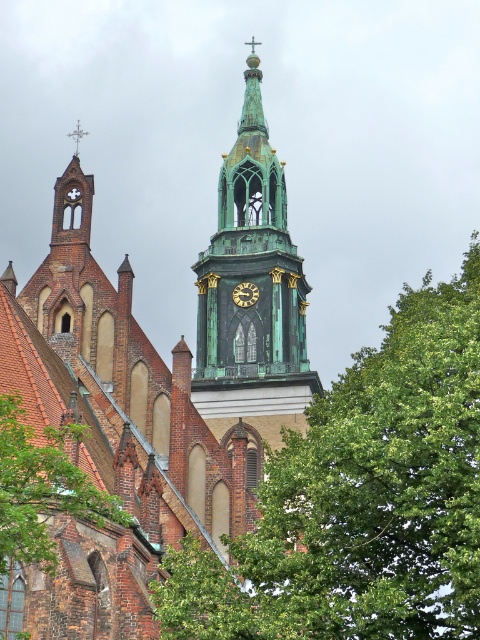
Can you confirm if green leafy tree at center is thinner than dark brown wooden clock at center?

No.

Who is shorter, green leafy tree at center or dark brown wooden clock at center?

With less height is dark brown wooden clock at center.

Which is behind, point (468, 579) or point (248, 298)?

Point (248, 298)

The height and width of the screenshot is (640, 480). I want to click on green leafy tree at center, so click(x=361, y=499).

Between green leafy tree at center and green leafy tree at lower left, which one appears on the right side from the viewer's perspective?

green leafy tree at center is more to the right.

Does point (156, 592) come closer to viewer compared to point (60, 452)?

No, (156, 592) is behind (60, 452).

Is point (168, 589) in front of point (13, 532)?

No, it is behind (13, 532).

The width and height of the screenshot is (480, 640). What are the coordinates of `green leafy tree at center` in the screenshot? It's located at (361, 499).

The height and width of the screenshot is (640, 480). Identify the location of green copper steeple at upper center. (158, 387).

Can you confirm if green copper steeple at upper center is shorter than green leafy tree at center?

Incorrect, green copper steeple at upper center's height does not fall short of green leafy tree at center's.

Between point (235, 145) and point (465, 260), which one is positioned behind?

Positioned behind is point (235, 145).

I want to click on green copper steeple at upper center, so click(158, 387).